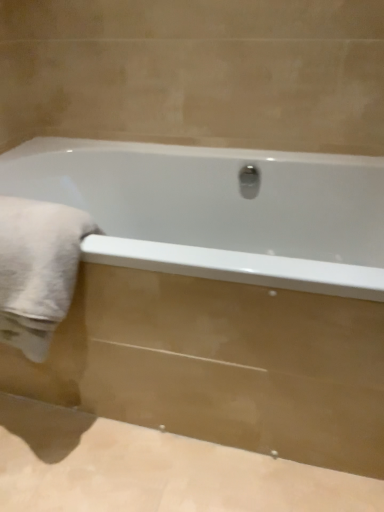
Question: Is white soft towel at left far from white glossy bathtub at center?

Choices:
 (A) no
 (B) yes

Answer: (A)

Question: From the image's perspective, is white soft towel at left beneath white glossy bathtub at center?

Choices:
 (A) no
 (B) yes

Answer: (A)

Question: Considering the relative positions of white soft towel at left and white glossy bathtub at center in the image provided, is white soft towel at left to the left of white glossy bathtub at center from the viewer's perspective?

Choices:
 (A) no
 (B) yes

Answer: (B)

Question: From a real-world perspective, is white soft towel at left located higher than white glossy bathtub at center?

Choices:
 (A) yes
 (B) no

Answer: (A)

Question: Is white soft towel at left aimed at white glossy bathtub at center?

Choices:
 (A) yes
 (B) no

Answer: (A)

Question: Is white soft towel at left positioned in front of white glossy bathtub at center?

Choices:
 (A) no
 (B) yes

Answer: (A)

Question: Is white soft towel at left surrounded by white glossy bathtub at center?

Choices:
 (A) no
 (B) yes

Answer: (B)

Question: Can you confirm if white glossy bathtub at center is thinner than white soft towel at left?

Choices:
 (A) no
 (B) yes

Answer: (A)

Question: Is white glossy bathtub at center turned away from white soft towel at left?

Choices:
 (A) no
 (B) yes

Answer: (A)

Question: Is white glossy bathtub at center outside white soft towel at left?

Choices:
 (A) yes
 (B) no

Answer: (A)

Question: Are white glossy bathtub at center and white soft towel at left beside each other?

Choices:
 (A) no
 (B) yes

Answer: (A)

Question: From a real-world perspective, is white glossy bathtub at center positioned under white soft towel at left based on gravity?

Choices:
 (A) yes
 (B) no

Answer: (A)

Question: Is white soft towel at left spatially inside white glossy bathtub at center, or outside of it?

Choices:
 (A) outside
 (B) inside

Answer: (B)